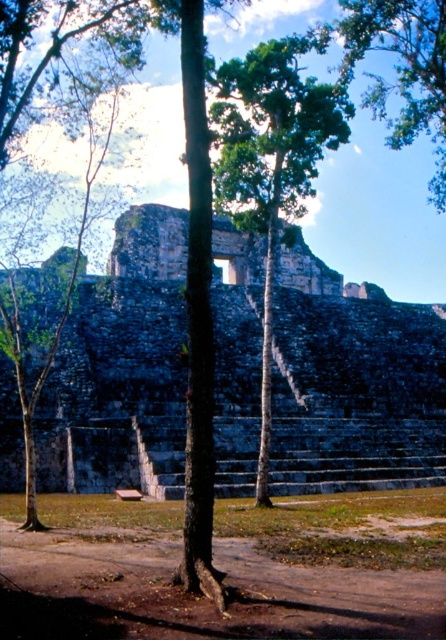
Does gray stone amphitheater at center come in front of green leafy tree at center?

No.

Is point (46, 401) positioned in front of point (243, 122)?

Yes, point (46, 401) is in front of point (243, 122).

Which is in front, point (161, 496) or point (272, 61)?

Point (161, 496)

Image resolution: width=446 pixels, height=640 pixels. In order to click on gray stone amphitheater at center in this screenshot , I will do `click(354, 387)`.